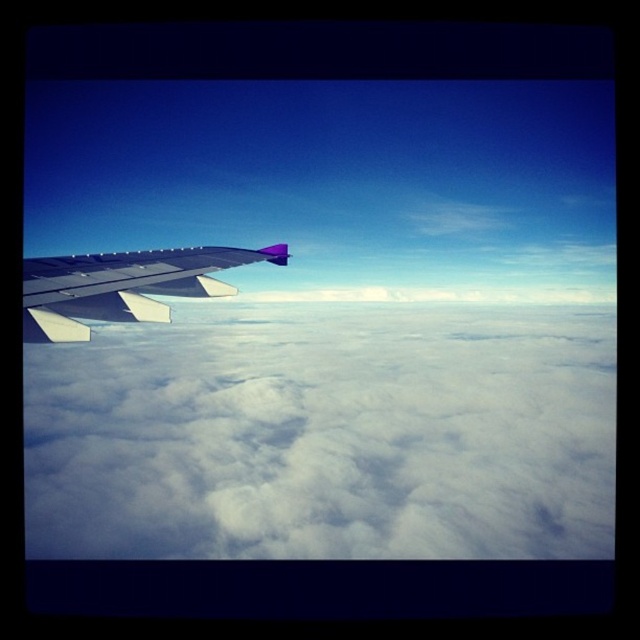
Question: In this image, where is white fluffy cloud at left located relative to metallic silver wing at left?

Choices:
 (A) below
 (B) above

Answer: (A)

Question: Which of the following is the farthest from the observer?

Choices:
 (A) (538, 520)
 (B) (58, 268)

Answer: (A)

Question: Which point is closer to the camera taking this photo?

Choices:
 (A) (134, 337)
 (B) (83, 296)

Answer: (B)

Question: Can you confirm if white fluffy cloud at left is smaller than metallic silver wing at left?

Choices:
 (A) no
 (B) yes

Answer: (A)

Question: From the image, what is the correct spatial relationship of white fluffy cloud at left in relation to metallic silver wing at left?

Choices:
 (A) left
 (B) right

Answer: (B)